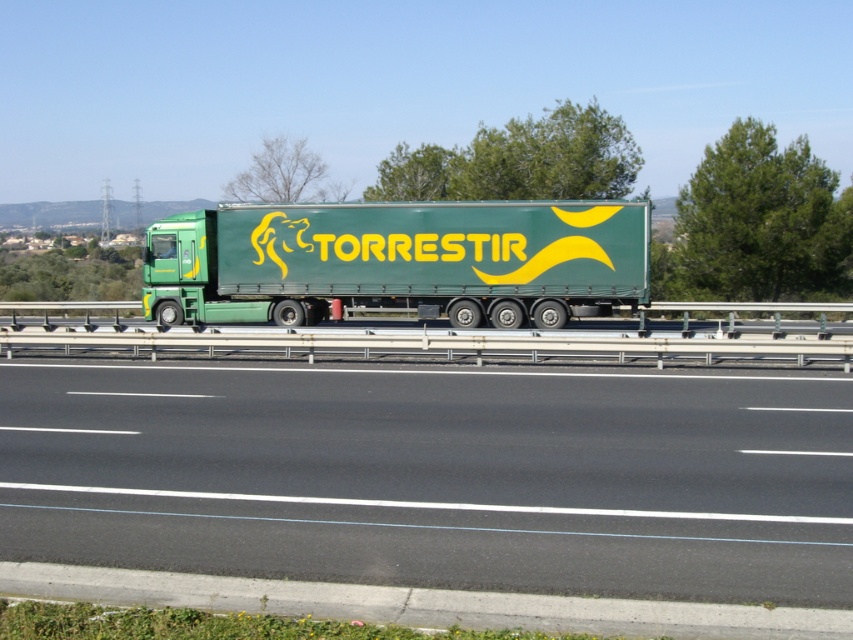
Question: Does black asphalt highway at center appear over green matte trailer truck at center?

Choices:
 (A) yes
 (B) no

Answer: (B)

Question: Which of the following is the closest to the observer?

Choices:
 (A) green matte trailer truck at center
 (B) black asphalt highway at center

Answer: (B)

Question: Is black asphalt highway at center to the right of green matte trailer truck at center from the viewer's perspective?

Choices:
 (A) no
 (B) yes

Answer: (B)

Question: Is black asphalt highway at center further to camera compared to green matte trailer truck at center?

Choices:
 (A) no
 (B) yes

Answer: (A)

Question: Among these points, which one is farthest from the camera?

Choices:
 (A) (456, 272)
 (B) (436, 484)

Answer: (A)